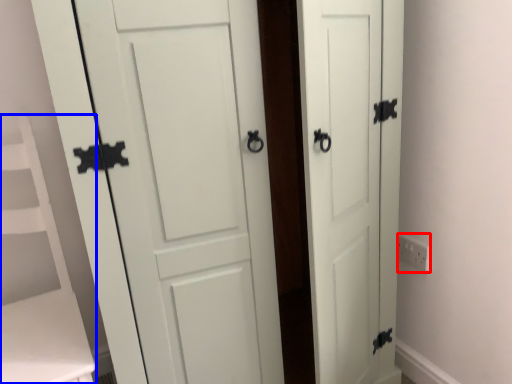
Question: Which object is closer to the camera taking this photo, electric outlet (highlighted by a red box) or vanity (highlighted by a blue box)?

Choices:
 (A) electric outlet
 (B) vanity

Answer: (B)